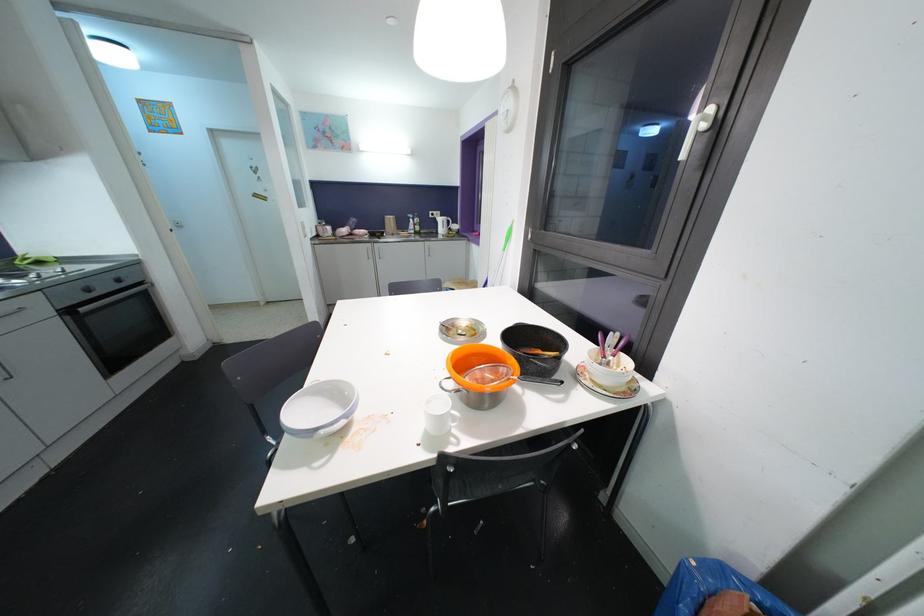
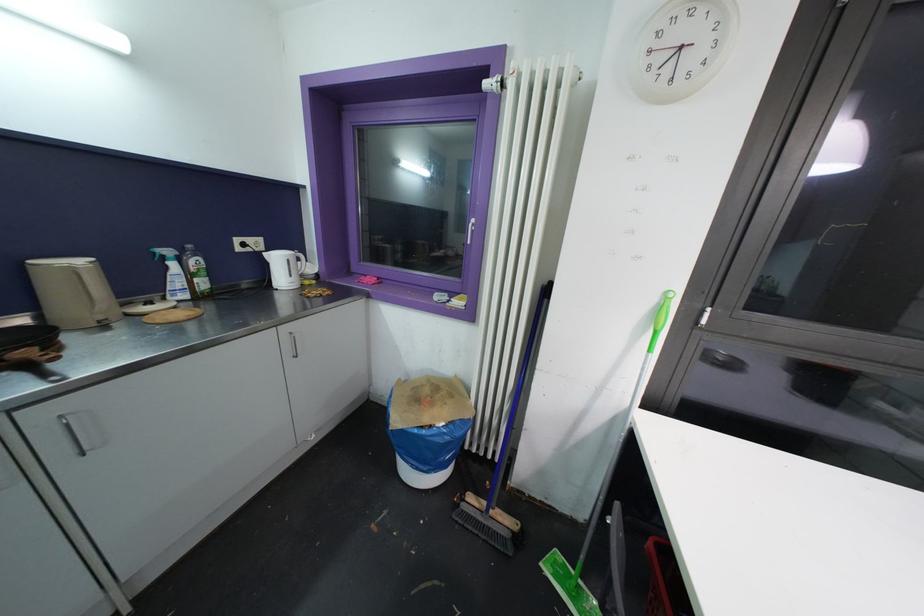
Where in the second image is the point corresponding to (x=444, y=223) from the first image?

(281, 262)